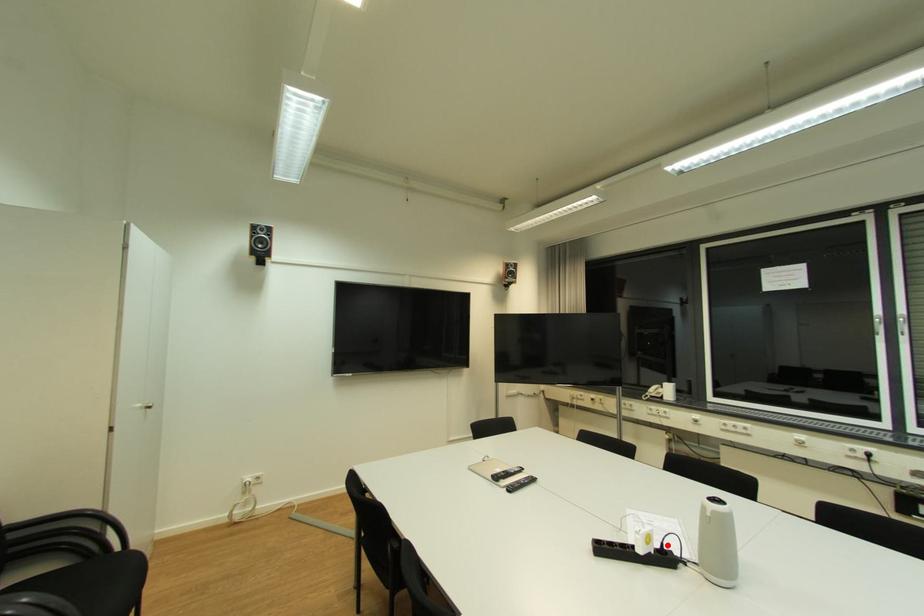
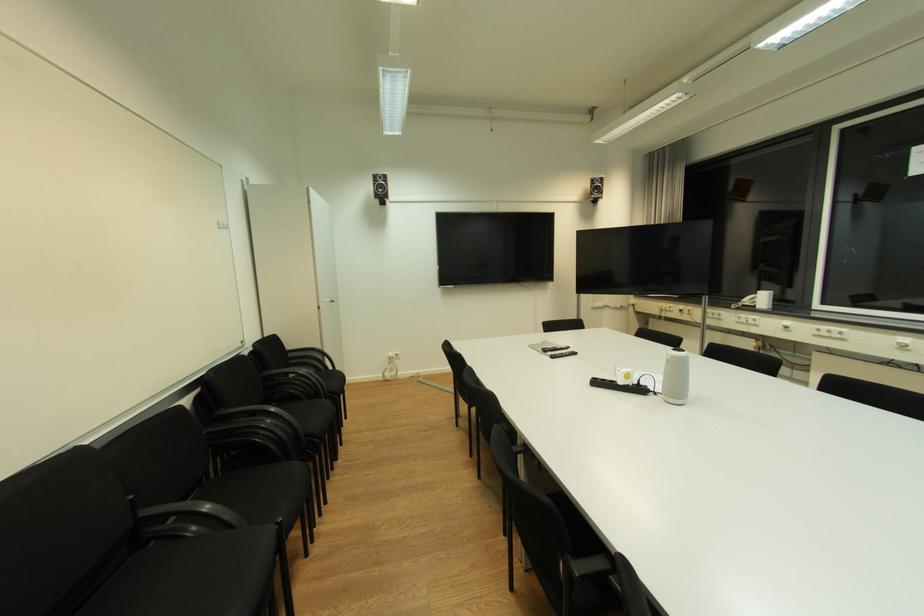
Locate, in the second image, the point that corresponds to the highlighted location in the first image.

(645, 381)